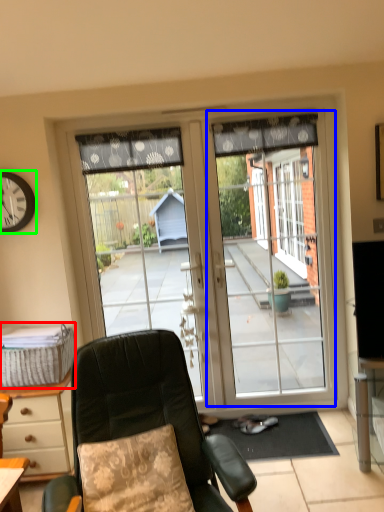
Question: Considering the real-world distances, which object is closest to picnic basket (highlighted by a red box)? screen door (highlighted by a blue box) or clock (highlighted by a green box).

Choices:
 (A) screen door
 (B) clock

Answer: (B)